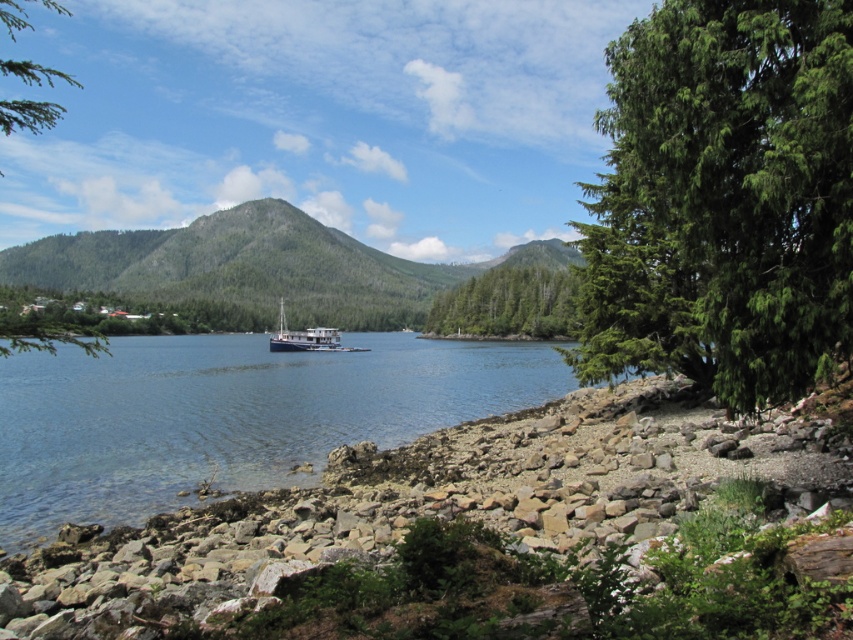
You are standing on the rocky shoreline and want to reach the blue matte boat at center. Which direction should you walk to avoid the green leafy tree at right?

Since the green leafy tree at right is positioned on the right side of the blue matte boat at center, you should walk towards the left side of the boat to avoid the tree.